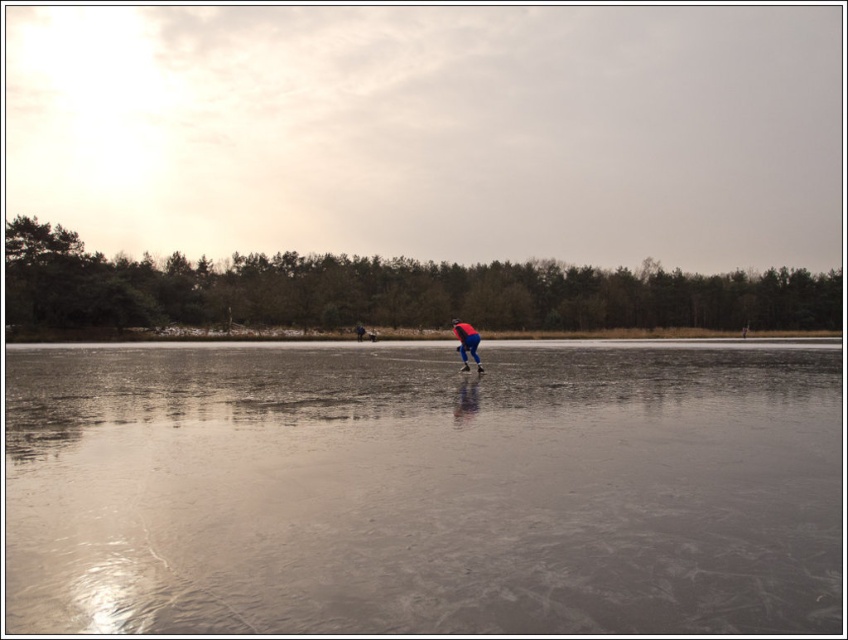
Can you confirm if transparent ice at center is thinner than blue fabric pants at center?

No.

The width and height of the screenshot is (848, 640). Find the location of `transparent ice at center`. transparent ice at center is located at coordinates (424, 486).

Between point (785, 486) and point (464, 365), which one is positioned in front?

Positioned in front is point (785, 486).

Where is `transparent ice at center`? transparent ice at center is located at coordinates (424, 486).